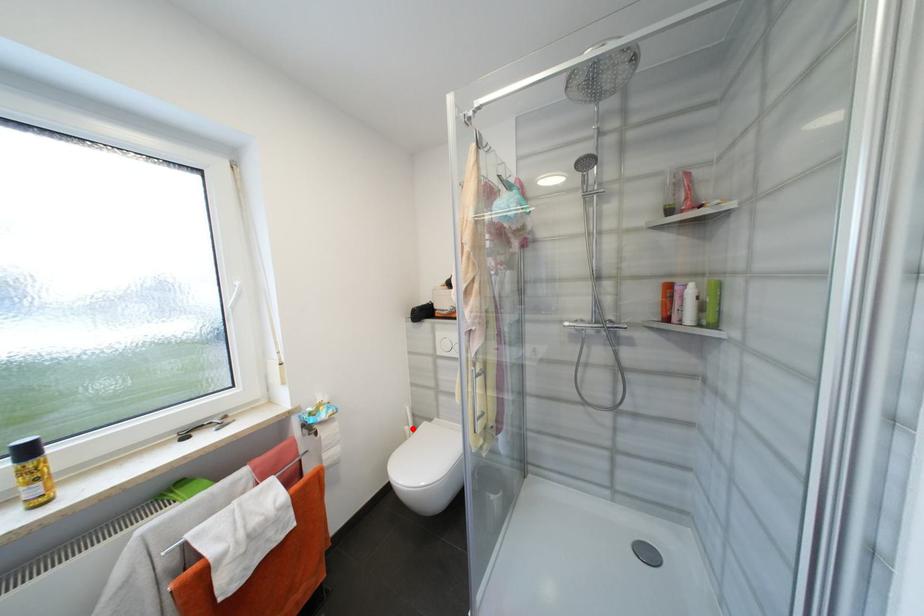
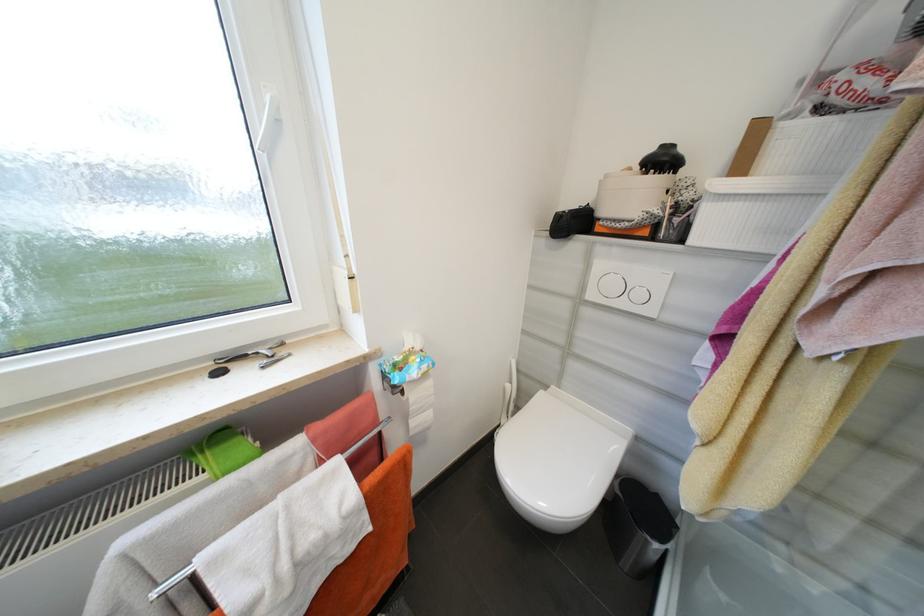
Question: I am providing you with two images of the same scene from different viewpoints. In image1, a red point is highlighted. Considering the same 3D point in image2, which of the following is correct?

Choices:
 (A) It is closer
 (B) It is farther

Answer: (A)